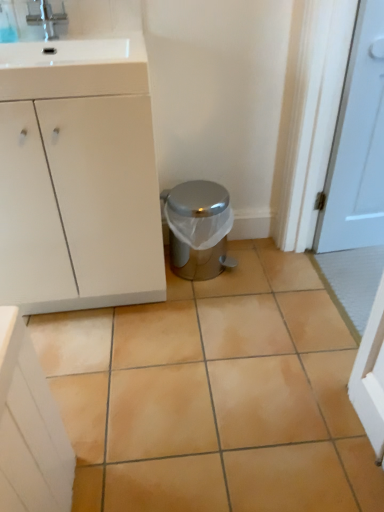
Question: From the image's perspective, is satin silver trash can at center located above or below brushed metal faucet at upper left?

Choices:
 (A) below
 (B) above

Answer: (A)

Question: From a real-world perspective, relative to brushed metal faucet at upper left, is satin silver trash can at center vertically above or below?

Choices:
 (A) above
 (B) below

Answer: (B)

Question: Which object is the closest to the white glossy sink at upper left?

Choices:
 (A) beige ceramic tile at center
 (B) white matte cabinet at left
 (C) brushed metal faucet at upper left
 (D) satin silver trash can at center

Answer: (B)

Question: Estimate the real-world distances between objects in this image. Which object is closer to the brushed metal faucet at upper left?

Choices:
 (A) beige ceramic tile at center
 (B) white glossy sink at upper left
 (C) white matte cabinet at left
 (D) satin silver trash can at center

Answer: (B)